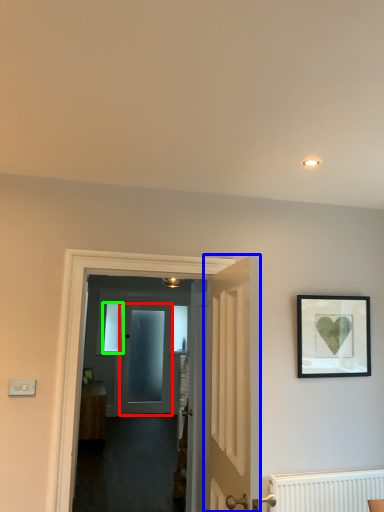
Question: Considering the real-world distances, which object is farthest from door (highlighted by a red box)? door (highlighted by a blue box) or window (highlighted by a green box)?

Choices:
 (A) door
 (B) window

Answer: (A)